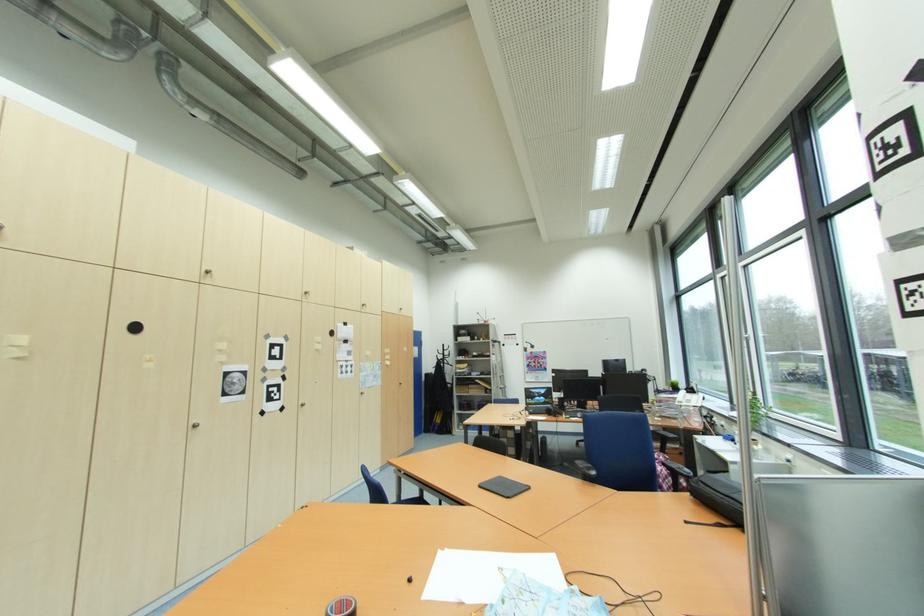
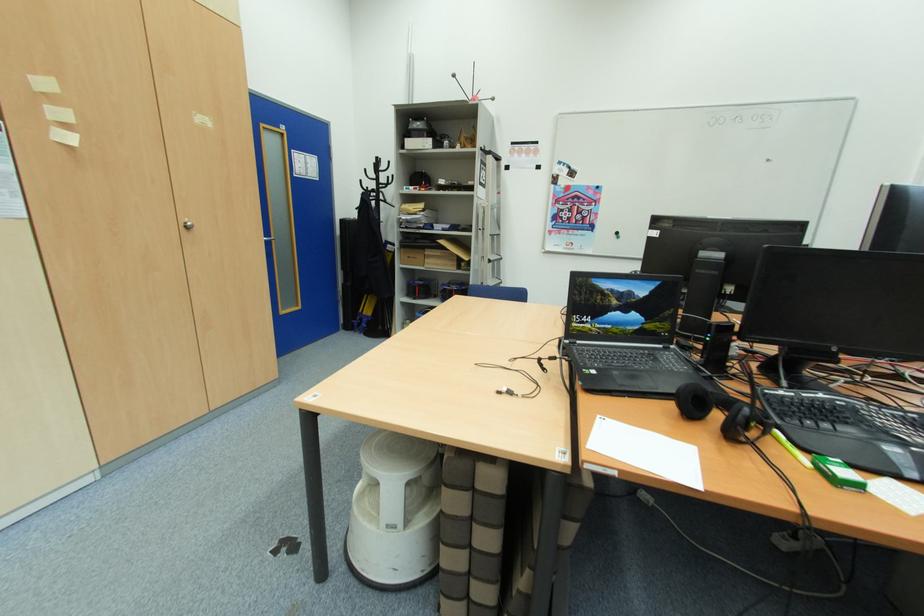
Question: What movement of the cameraman would produce the second image?

Choices:
 (A) Left
 (B) Right
 (C) Forward
 (D) Backward

Answer: (C)